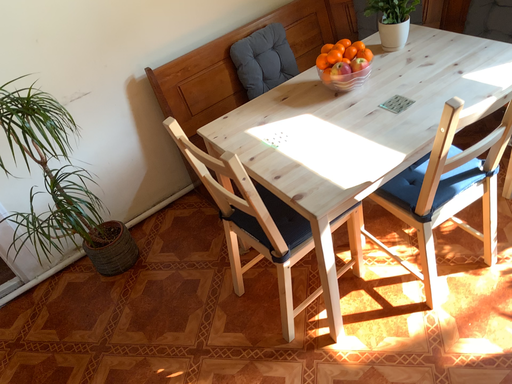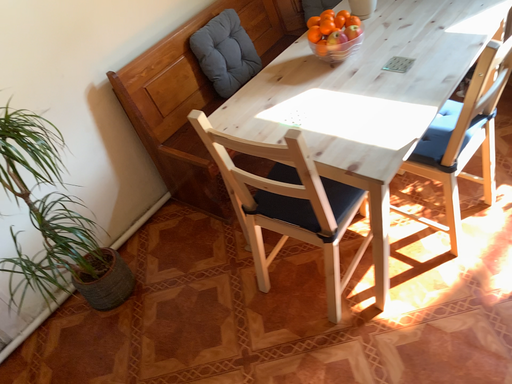
Question: How did the camera likely rotate when shooting the video?

Choices:
 (A) rotated right
 (B) rotated left

Answer: (A)